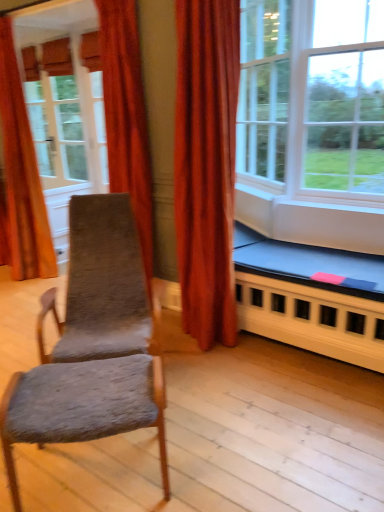
Question: From the image's perspective, relative to white glass window at upper right, placed as the second window when sorted from right to left, is textured gray fabric rocking chair at left above or below?

Choices:
 (A) above
 (B) below

Answer: (B)

Question: Considering the positions of textured gray fabric rocking chair at left and white glass window at upper right, which appears as the first window when viewed from the left, in the image, is textured gray fabric rocking chair at left taller or shorter than white glass window at upper right, which appears as the first window when viewed from the left,?

Choices:
 (A) tall
 (B) short

Answer: (B)

Question: Which object is the farthest from the white glass window at upper right, placed as the second window when sorted from right to left?

Choices:
 (A) velvet orange curtain at upper left, which is the 2th curtain in back-to-front order
 (B) matte white screen door at upper left
 (C) textured gray fabric chair at center
 (D) velvet orange curtain at left, positioned as the 1th curtain in left-to-right order
 (E) textured gray fabric rocking chair at left

Answer: (C)

Question: Which object is positioned closest to the matte white screen door at upper left?

Choices:
 (A) velvet orange curtain at upper left, acting as the first curtain starting from the right
 (B) textured gray fabric chair at center
 (C) textured gray fabric rocking chair at left
 (D) velvet orange curtain at left, which appears as the second curtain when viewed from the front
 (E) blue fabric bed frame at lower right

Answer: (D)